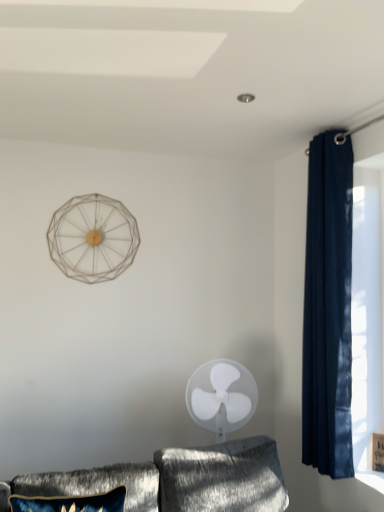
Question: Which is correct: navy velvet curtain at right is inside velvet blue pillow at lower left, or outside of it?

Choices:
 (A) outside
 (B) inside

Answer: (A)

Question: Visually, is navy velvet curtain at right positioned to the left or to the right of velvet blue pillow at lower left?

Choices:
 (A) right
 (B) left

Answer: (A)

Question: Which object is the farthest from the velvet blue pillow at lower left?

Choices:
 (A) navy velvet curtain at right
 (B) white plastic fan at center

Answer: (A)

Question: Considering the real-world distances, which object is farthest from the velvet blue pillow at lower left?

Choices:
 (A) white plastic fan at center
 (B) navy velvet curtain at right

Answer: (B)